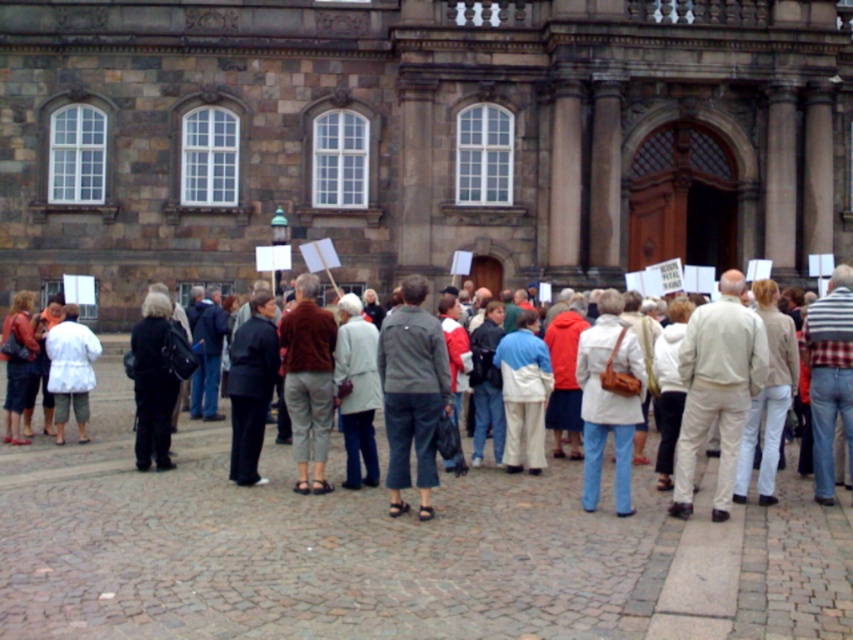
Question: Which object is the farthest from the gray fabric jacket at center?

Choices:
 (A) beige cotton pants at right
 (B) white matte jacket at lower left

Answer: (B)

Question: Does gray fabric jacket at center come behind white matte jacket at lower left?

Choices:
 (A) no
 (B) yes

Answer: (A)

Question: Which object is closer to the camera taking this photo?

Choices:
 (A) gray fabric jacket at center
 (B) white matte jacket at lower left

Answer: (A)

Question: Can you confirm if beige cotton pants at right is positioned to the right of gray fabric jacket at center?

Choices:
 (A) yes
 (B) no

Answer: (A)

Question: Is beige cotton pants at right below gray fabric jacket at center?

Choices:
 (A) yes
 (B) no

Answer: (A)

Question: Which point is farther to the camera?

Choices:
 (A) (422, 365)
 (B) (54, 406)
 (C) (680, 369)

Answer: (B)